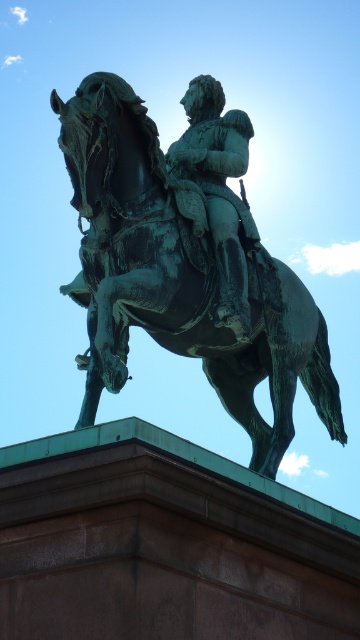
Which is more to the left, green patina statue at center or green patina armor at center?

green patina statue at center

Can you confirm if green patina statue at center is shorter than green patina armor at center?

In fact, green patina statue at center may be taller than green patina armor at center.

Does point (108, 227) come closer to viewer compared to point (240, 125)?

That is True.

At what (x,y) coordinates should I click in order to perform the action: click on green patina statue at center. Please return your answer as a coordinate pair (x, y). The height and width of the screenshot is (640, 360). Looking at the image, I should click on (178, 276).